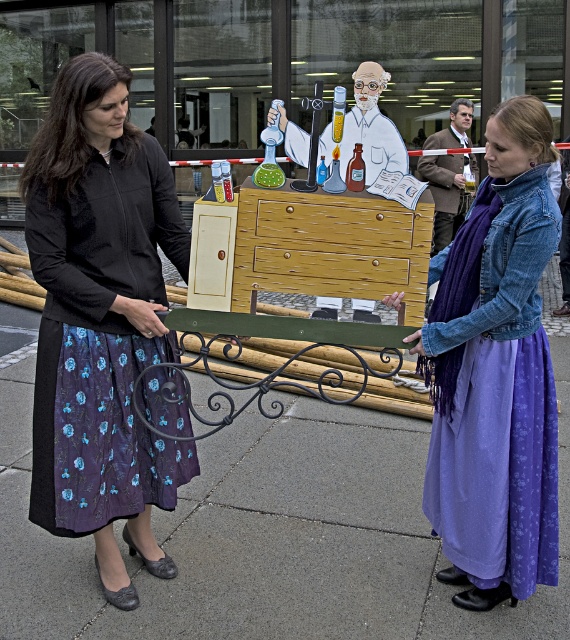
Question: Which point appears farthest from the camera in this image?

Choices:
 (A) (127, 500)
 (B) (280, 116)
 (C) (263, 465)

Answer: (B)

Question: Where is purple cotton skirt at lower right located in relation to wooden cabinet at center in the image?

Choices:
 (A) below
 (B) above

Answer: (A)

Question: Is concrete pavement at center below velvet black blouse at left?

Choices:
 (A) no
 (B) yes

Answer: (B)

Question: Is velvet black blouse at left closer to the viewer compared to purple cotton skirt at lower right?

Choices:
 (A) yes
 (B) no

Answer: (B)

Question: Based on their relative distances, which object is farther from the concrete pavement at center?

Choices:
 (A) velvet black blouse at left
 (B) wooden cabinet at center

Answer: (B)

Question: Among these objects, which one is nearest to the camera?

Choices:
 (A) brown leather jacket at center
 (B) wooden cabinet at center
 (C) purple cotton skirt at lower right
 (D) velvet black blouse at left

Answer: (C)